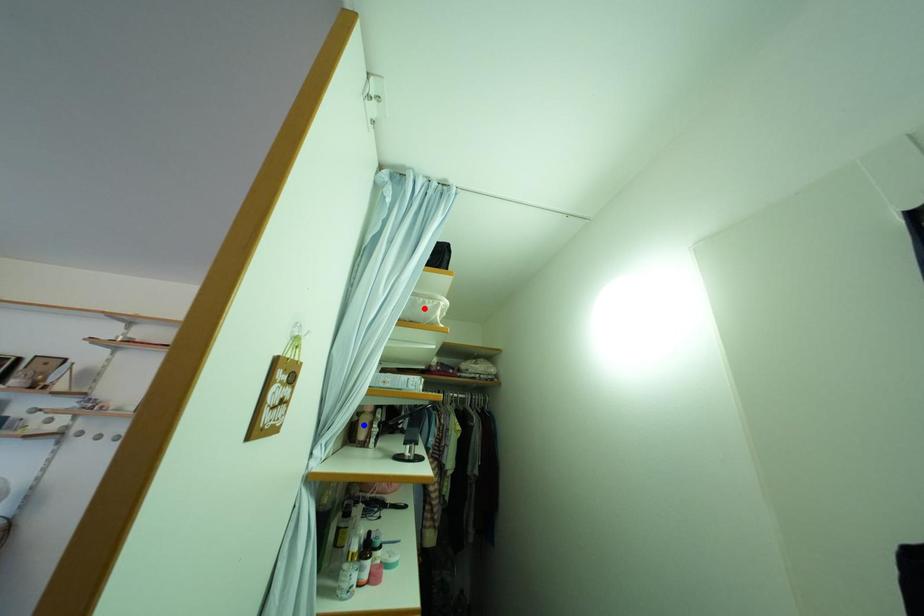
Question: Which of the two points in the image is closer to the camera?

Choices:
 (A) Blue point is closer.
 (B) Red point is closer.

Answer: (B)